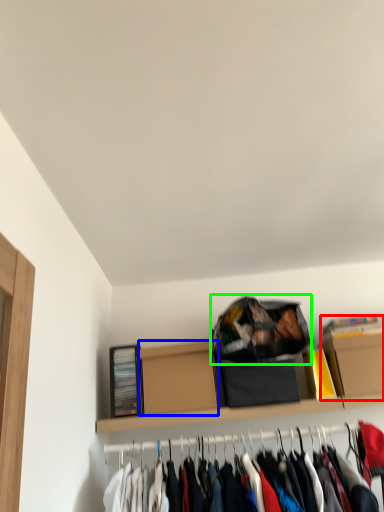
Question: Estimate the real-world distances between objects in this image. Which object is farther from cardboard box (highlighted by a red box), cardboard box (highlighted by a blue box) or bag (highlighted by a green box)?

Choices:
 (A) cardboard box
 (B) bag

Answer: (A)